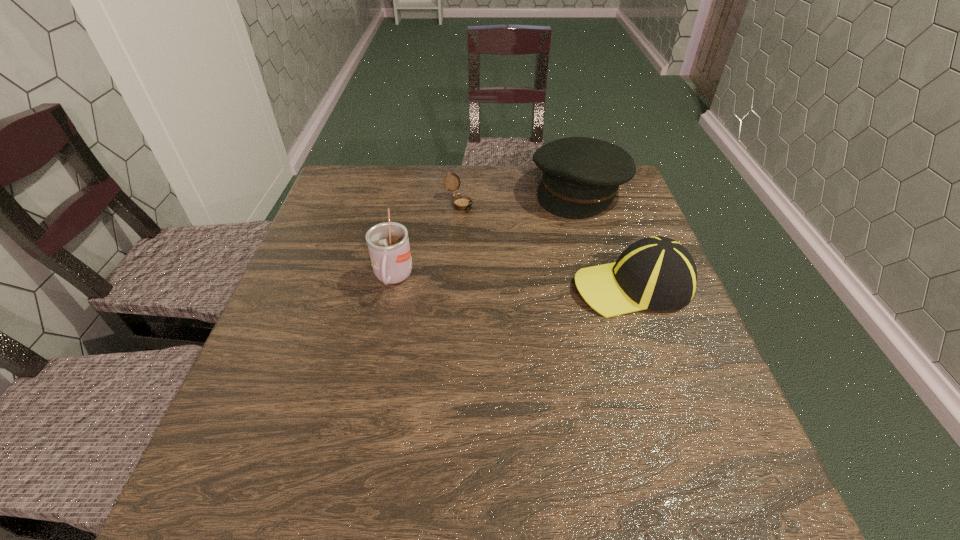
Where is `cup`? This screenshot has width=960, height=540. cup is located at coordinates (388, 243).

The height and width of the screenshot is (540, 960). In order to click on baseball cap in this screenshot , I will do `click(658, 273)`.

Locate an element on the screen. This screenshot has width=960, height=540. compass is located at coordinates (461, 202).

Image resolution: width=960 pixels, height=540 pixels. In order to click on the shortest object in this screenshot , I will do `click(461, 202)`.

Locate an element on the screen. beret is located at coordinates (581, 176).

In order to click on vacant region located on the side with the handle of the cup in this screenshot , I will do `click(378, 352)`.

Find the location of a particular element. The width and height of the screenshot is (960, 540). vacant region located 0.120m with the brim of the baseball cap facing forward is located at coordinates (520, 285).

Image resolution: width=960 pixels, height=540 pixels. In order to click on vacant region located 0.240m with the brim of the baseball cap facing forward in this screenshot , I will do `click(468, 285)`.

Image resolution: width=960 pixels, height=540 pixels. In order to click on vacant space located 0.130m with the brim of the baseball cap facing forward in this screenshot , I will do `click(516, 285)`.

The height and width of the screenshot is (540, 960). Find the location of `free space located 0.200m on the face of the compass`. free space located 0.200m on the face of the compass is located at coordinates (508, 253).